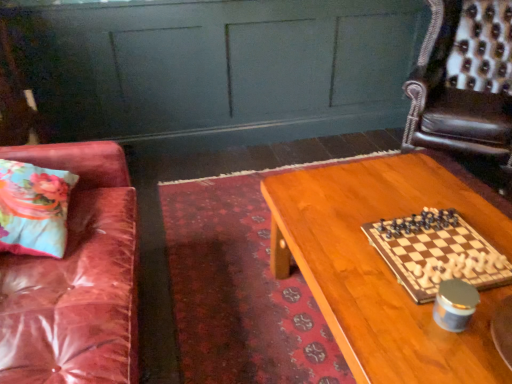
The image size is (512, 384). In order to click on empty space that is ontop of wooden table at center (from a real-world perspective) in this screenshot , I will do `click(401, 242)`.